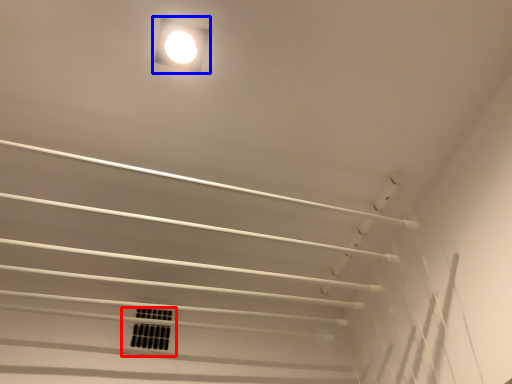
Question: Which of the following is the farthest to the observer, window (highlighted by a red box) or lamp (highlighted by a blue box)?

Choices:
 (A) window
 (B) lamp

Answer: (A)